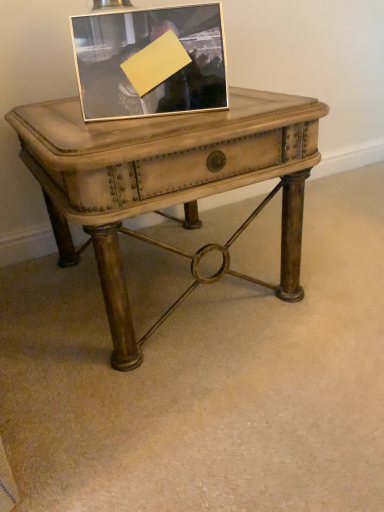
Locate an element on the screen. This screenshot has height=512, width=384. vacant space in front of silver metallic picture frame at upper center is located at coordinates (138, 130).